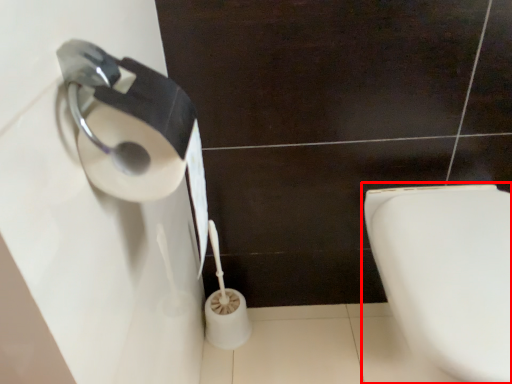
Question: From the image, what is the correct spatial relationship of toilet (annotated by the red box) in relation to toilet paper?

Choices:
 (A) right
 (B) left

Answer: (A)